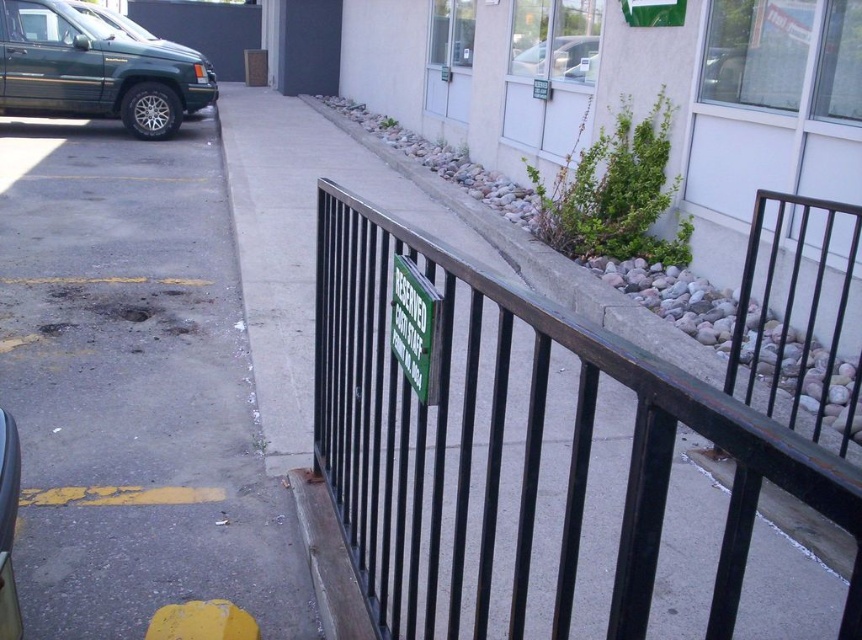
You are standing at the edge of the parking lot and want to place a 2.5 meter tall ladder vertically between the gray asphalt at left and the black metal fence at center. Can the ladder fit vertically between them without tilting?

The gray asphalt at left has a greater height compared to black metal fence at center, so the vertical space between them is sufficient to accommodate a 2.5 meter tall ladder without tilting.

You are a delivery driver who needs to park your truck in the parking lot. You see the black metal fence at center and the green matte suv at left. Which object is closer to the ground?

The black metal fence at center is positioned under the green matte suv at left, meaning it is closer to the ground.

You are standing at point (x=144, y=60) and want to walk to point (x=473, y=632). Which direction should you move relative to the parking lot layout?

You should move forward towards the parking lot entrance because point (x=473, y=632) is in front of point (x=144, y=60).